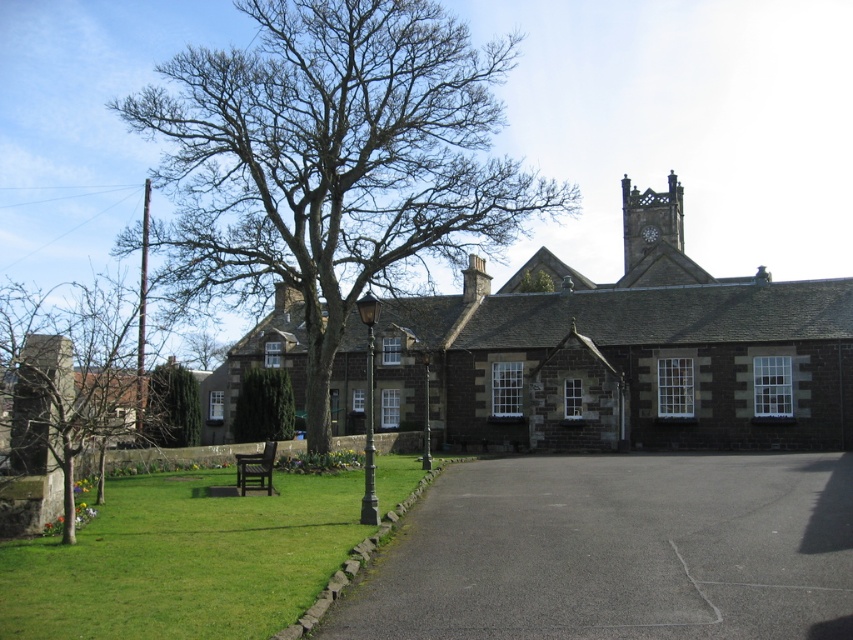
Question: Where is green textured hedge at center located in relation to dark brown wooden bench at center in the image?

Choices:
 (A) above
 (B) below

Answer: (A)

Question: Which of these objects is positioned farthest from the bare wood tree at center?

Choices:
 (A) brown stone church at center
 (B) green grass at lower left

Answer: (A)

Question: Which point is farther to the camera?

Choices:
 (A) (596, 614)
 (B) (316, 266)

Answer: (B)

Question: Among these objects, which one is nearest to the camera?

Choices:
 (A) black asphalt driveway at center
 (B) brown stone church at center
 (C) green grass at lower left

Answer: (C)

Question: Is black asphalt driveway at center to the left of green textured hedge at center from the viewer's perspective?

Choices:
 (A) no
 (B) yes

Answer: (A)

Question: Can you confirm if black asphalt driveway at center is bigger than dark brown wooden bench at center?

Choices:
 (A) yes
 (B) no

Answer: (A)